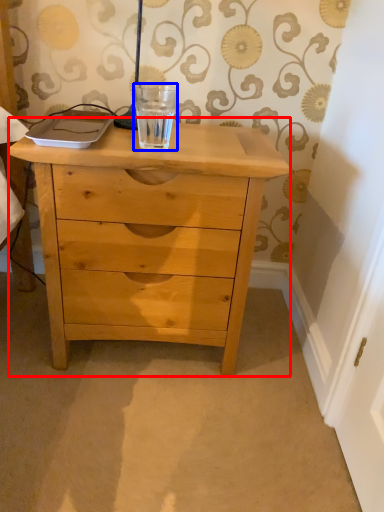
Question: Which object is further to the camera taking this photo, chest of drawers (highlighted by a red box) or beverage (highlighted by a blue box)?

Choices:
 (A) chest of drawers
 (B) beverage

Answer: (B)